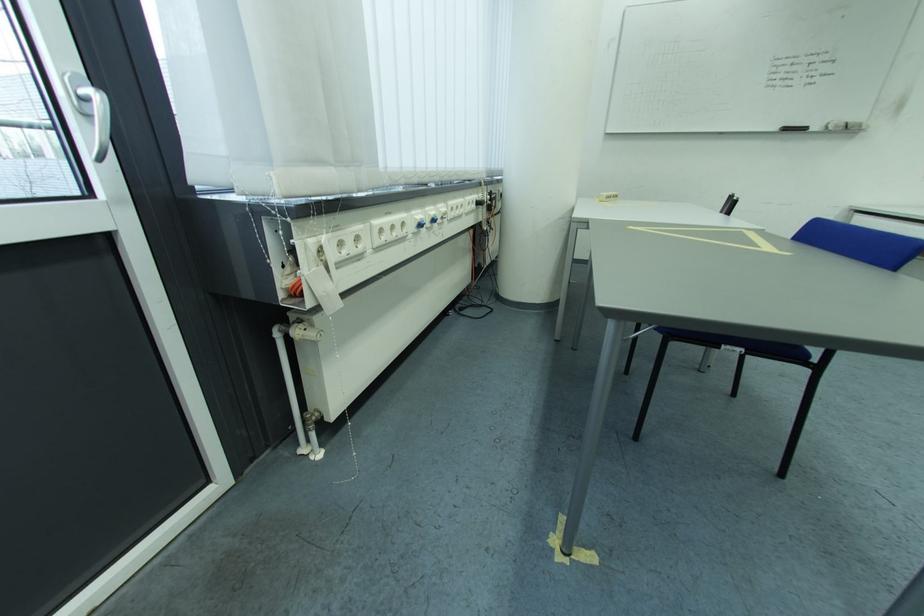
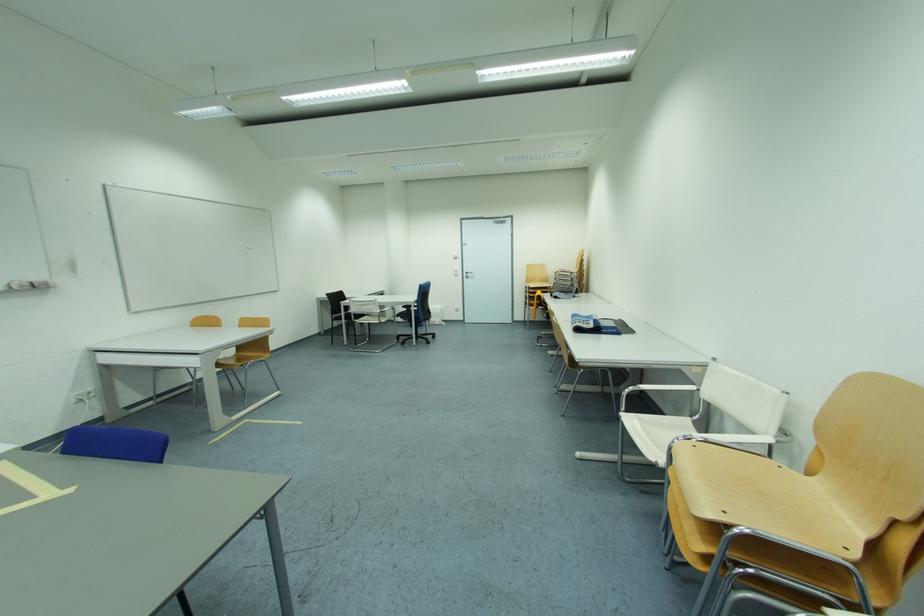
Question: The camera is either moving clockwise (left) or counter-clockwise (right) around the object. The first image is from the beginning of the video and the second image is from the end. Is the camera moving left or right when shooting the video?

Choices:
 (A) Left
 (B) Right

Answer: (A)